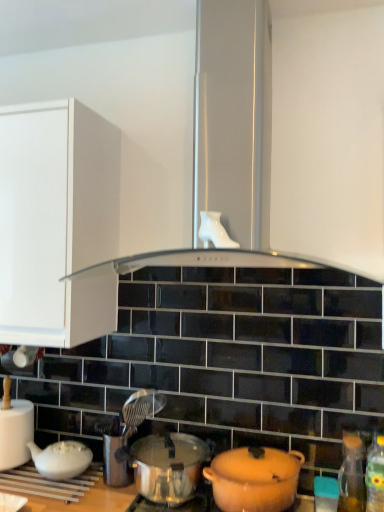
Question: Does black glass exhaust hood at center appear on the left side of transparent glass bottle at lower right, which ranks as the 2th bottle in front-to-back order?

Choices:
 (A) no
 (B) yes

Answer: (B)

Question: Can transparent glass bottle at lower right, which is counted as the first bottle, starting from the back, be found inside black glass exhaust hood at center?

Choices:
 (A) yes
 (B) no

Answer: (B)

Question: Does black glass exhaust hood at center turn towards transparent glass bottle at lower right, which ranks as the 2th bottle in front-to-back order?

Choices:
 (A) no
 (B) yes

Answer: (A)

Question: Does black glass exhaust hood at center have a larger size compared to transparent glass bottle at lower right, which ranks as the 2th bottle in front-to-back order?

Choices:
 (A) no
 (B) yes

Answer: (B)

Question: Does black glass exhaust hood at center have a smaller size compared to transparent glass bottle at lower right, which ranks as the 2th bottle in front-to-back order?

Choices:
 (A) yes
 (B) no

Answer: (B)

Question: From the image's perspective, is matte orange pot at lower center, positioned as the 2th pot/pan in left-to-right order, located above or below teal plastic container at lower right?

Choices:
 (A) below
 (B) above

Answer: (B)

Question: In terms of size, does matte orange pot at lower center, positioned as the 2th pot/pan in left-to-right order, appear bigger or smaller than teal plastic container at lower right?

Choices:
 (A) big
 (B) small

Answer: (A)

Question: Looking at their shapes, would you say matte orange pot at lower center, which appears as the first pot/pan when viewed from the right, is wider or thinner than teal plastic container at lower right?

Choices:
 (A) wide
 (B) thin

Answer: (A)

Question: From a real-world perspective, is matte orange pot at lower center, positioned as the 2th pot/pan in left-to-right order, above or below teal plastic container at lower right?

Choices:
 (A) below
 (B) above

Answer: (B)

Question: Is point (231, 478) closer or farther from the camera than point (4, 426)?

Choices:
 (A) closer
 (B) farther

Answer: (A)

Question: Is matte orange pot at lower center, which appears as the first pot/pan when viewed from the right, taller or shorter than white matte teapot at lower left?

Choices:
 (A) short
 (B) tall

Answer: (A)

Question: Relative to white matte teapot at lower left, is matte orange pot at lower center, positioned as the 2th pot/pan in left-to-right order, in front or behind?

Choices:
 (A) behind
 (B) front

Answer: (B)

Question: From a real-world perspective, is matte orange pot at lower center, positioned as the 2th pot/pan in left-to-right order, physically located above or below white matte teapot at lower left?

Choices:
 (A) below
 (B) above

Answer: (A)

Question: Visually, is shiny silver pot at center, arranged as the first pot/pan when viewed from the left, positioned to the left or to the right of green plastic bottle at lower right, which is the first bottle in front-to-back order?

Choices:
 (A) right
 (B) left

Answer: (B)

Question: Considering their positions, is shiny silver pot at center, arranged as the first pot/pan when viewed from the left, located in front of or behind green plastic bottle at lower right, the second bottle positioned from the back?

Choices:
 (A) front
 (B) behind

Answer: (B)